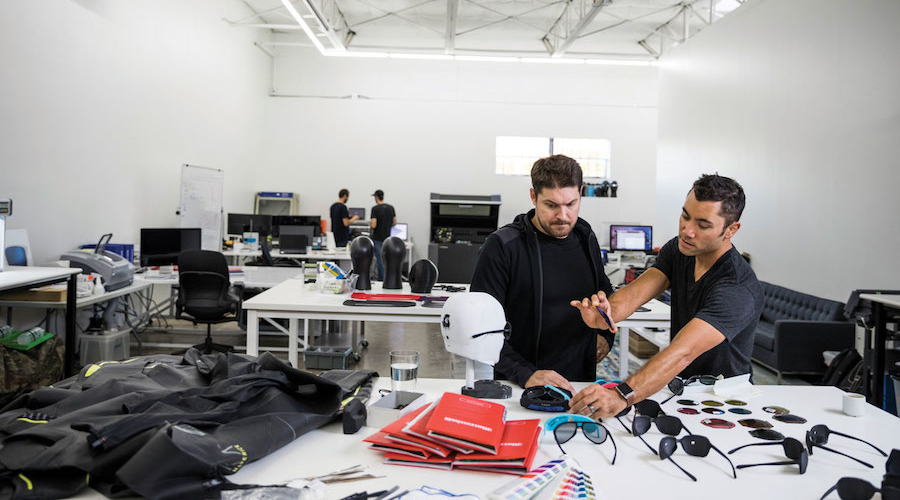
Find the location of a particular element. printer is located at coordinates (104, 262).